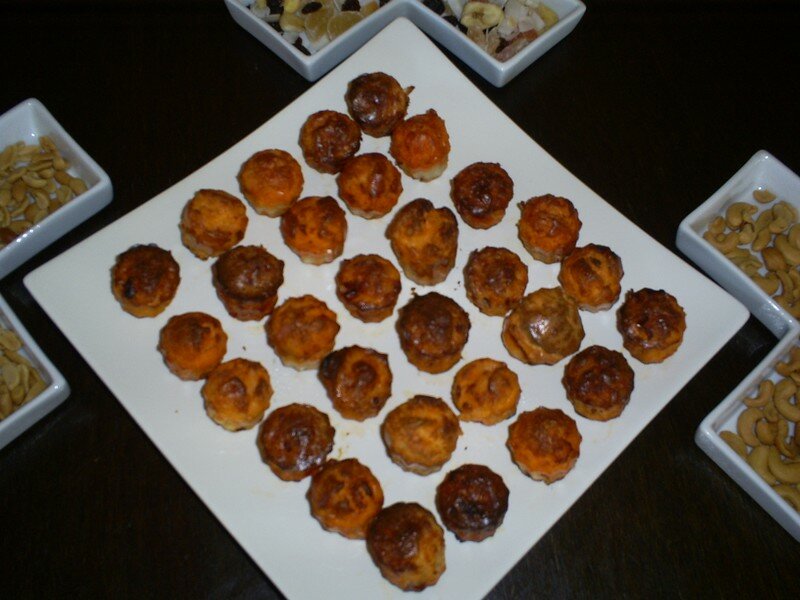
At what (x,y) coordinates should I click in order to perform the action: click on place where i would put napkins. Please return your answer as a coordinate pair (x, y). The image size is (800, 600). Looking at the image, I should click on (624, 547), (140, 575), (150, 82), (693, 47).